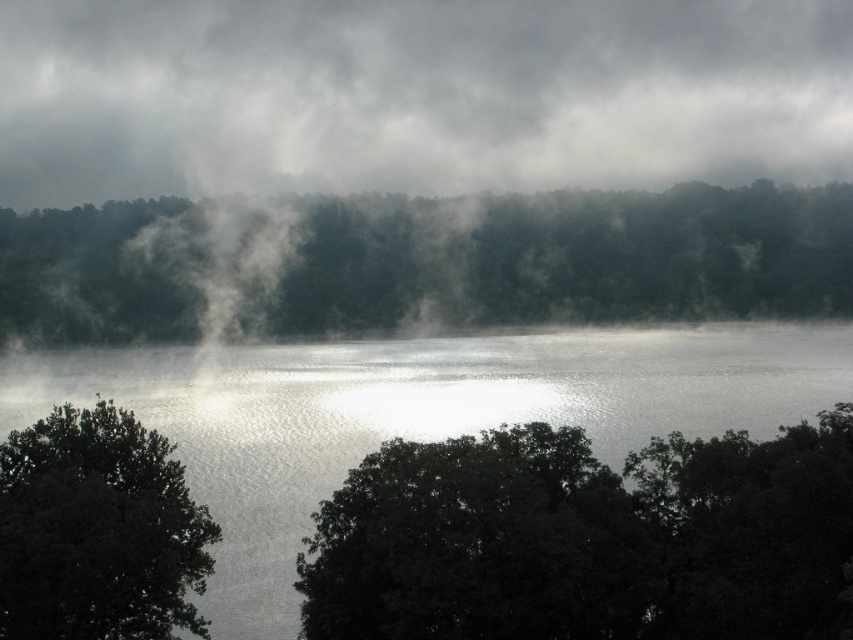
You are an observer standing at the edge of the lake. You see the gray fog at upper center and the dark green leafy tree at lower left. Which object is positioned more to the east if the sun is setting in the west?

The gray fog at upper center is positioned more to the east because it is to the right of the dark green leafy tree at lower left, and since the sun is setting in the west, the right side of the image corresponds to the east direction.

You are standing in the misty landscape shown in the image. There is a gray fog at upper center located at point [416,96]. Where is the gray fog at upper center in terms of coordinates?

The gray fog at upper center is located at point [416,96].